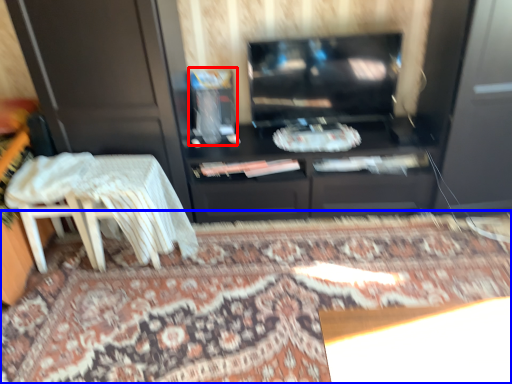
Question: Which object appears farthest to the camera in this image, appliance (highlighted by a red box) or mat (highlighted by a blue box)?

Choices:
 (A) appliance
 (B) mat

Answer: (A)